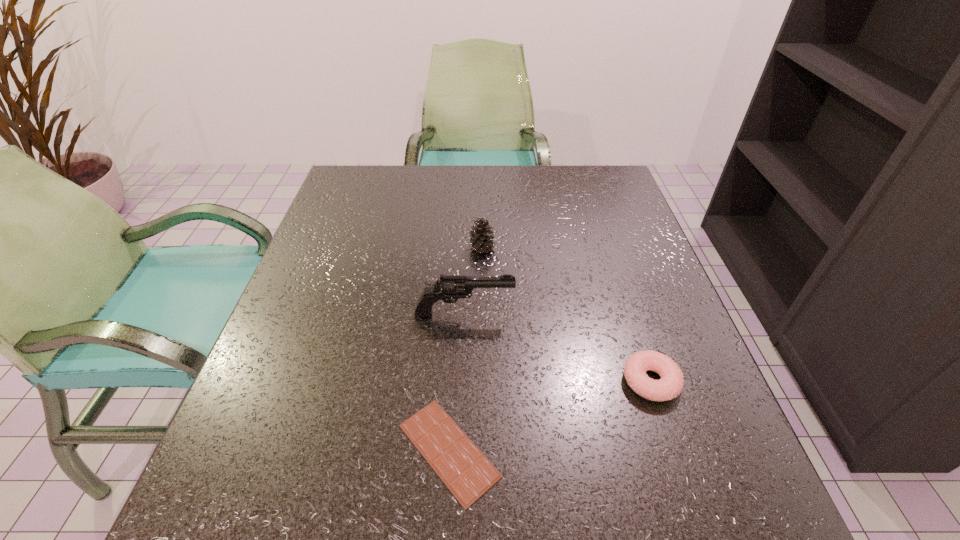
Where is `free location that satisfies the following two spatial constraints: 1. on the front side of the pinecone; 2. at the end of the barrel of the tallest object`? This screenshot has height=540, width=960. free location that satisfies the following two spatial constraints: 1. on the front side of the pinecone; 2. at the end of the barrel of the tallest object is located at coordinates (482, 314).

Locate an element on the screen. This screenshot has width=960, height=540. blank area in the image that satisfies the following two spatial constraints: 1. at the end of the barrel of the doughnut; 2. on the left side of the gun is located at coordinates (462, 381).

Find the location of a particular element. The height and width of the screenshot is (540, 960). free location that satisfies the following two spatial constraints: 1. at the end of the barrel of the gun; 2. on the right side of the second shortest object is located at coordinates tap(462, 381).

Where is `vacant space that satisfies the following two spatial constraints: 1. at the end of the barrel of the gun; 2. on the back side of the doughnut`? The height and width of the screenshot is (540, 960). vacant space that satisfies the following two spatial constraints: 1. at the end of the barrel of the gun; 2. on the back side of the doughnut is located at coordinates (462, 381).